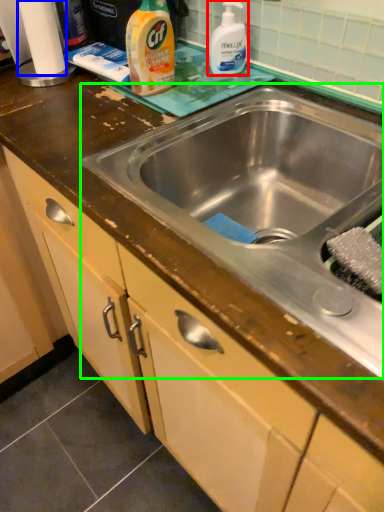
Question: Which object is the farthest from cleaning product (highlighted by a red box)? Choose among these: toilet paper (highlighted by a blue box) or sink (highlighted by a green box).

Choices:
 (A) toilet paper
 (B) sink

Answer: (A)